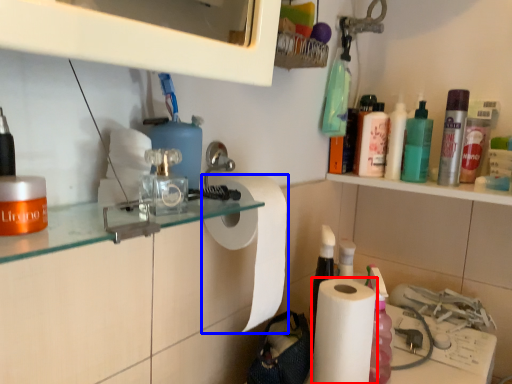
Question: Which of the following is the closest to the observer, paper towel (highlighted by a red box) or paper towel (highlighted by a blue box)?

Choices:
 (A) paper towel
 (B) paper towel

Answer: (B)